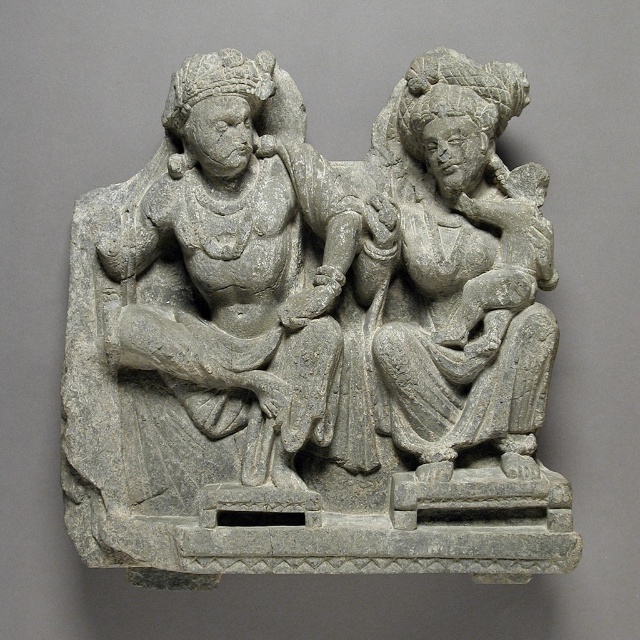
Consider the image. You are an art historian examining the stone relief sculpture. You notice two figures in the image. Which of the two figures, the gray stone sculpture at center or the gray stone statue at right, is located to the right side of the other?

The gray stone sculpture at center is positioned on the left side of the gray stone statue at right, meaning the gray stone statue at right is located to the right of the gray stone sculpture at center.

You are an art conservator examining the stone relief sculpture. You need to determine which object is taller between the gray stone sculpture at center and the gray stone statue at right. Based on the description, which one is taller?

The gray stone sculpture at center is much taller than the gray stone statue at right.

You are an archaeologist examining the stone relief sculpture. You notice two figures in the scene. Which of the two figures, the gray stone sculpture at center or the gray stone statue at left, is larger in size?

The gray stone sculpture at center is bigger than the gray stone statue at left.